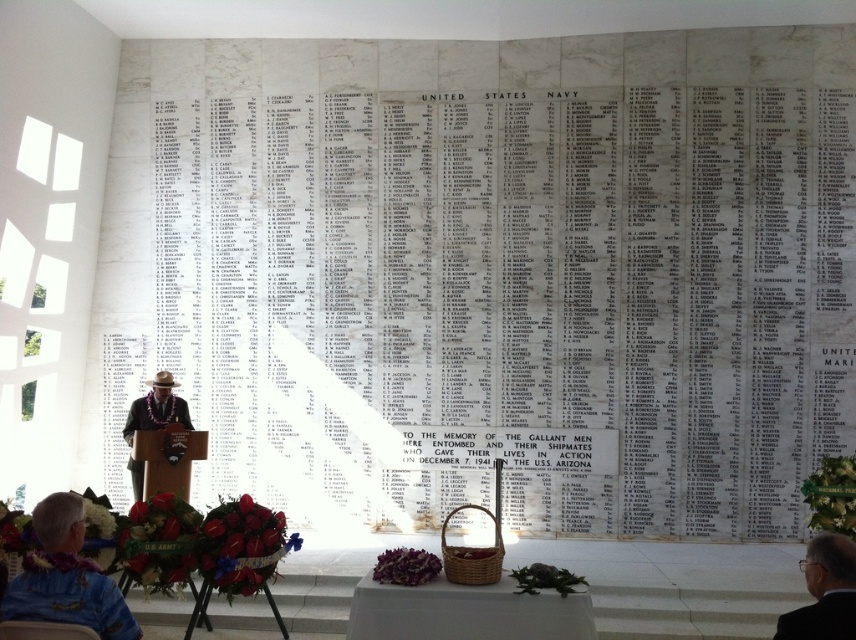
Question: Is black leather jacket at lower right thinner than wooden chair at lower left?

Choices:
 (A) no
 (B) yes

Answer: (B)

Question: Which object is closer to the camera taking this photo?

Choices:
 (A) matte brown hat at center
 (B) wooden chair at lower left
 (C) white fabric table at center
 (D) black leather jacket at lower right

Answer: (D)

Question: Is white fabric table at center positioned behind white fabric at lower left?

Choices:
 (A) no
 (B) yes

Answer: (B)

Question: Does matte brown hat at center appear on the right side of wooden chair at lower left?

Choices:
 (A) no
 (B) yes

Answer: (A)

Question: Which object appears farthest from the camera in this image?

Choices:
 (A) matte brown hat at center
 (B) white fabric at lower left
 (C) black leather jacket at lower right

Answer: (A)

Question: Which of the following is the closest to the observer?

Choices:
 (A) wooden chair at lower left
 (B) matte brown hat at center

Answer: (A)